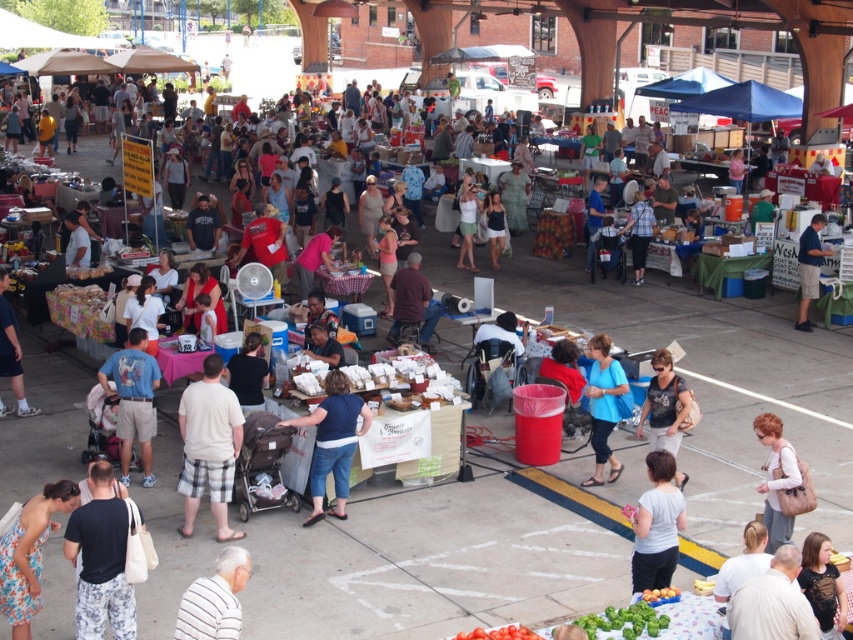
Question: Observing the image, what is the correct spatial positioning of light blue shirt at lower left in reference to green matte brussels sprouts at lower center?

Choices:
 (A) below
 (B) above

Answer: (B)

Question: Which object appears closest to the camera in this image?

Choices:
 (A) matte beige backpack at lower right
 (B) blue plaid shirt at center

Answer: (A)

Question: Which point is closer to the camera?

Choices:
 (A) light blue shirt at lower left
 (B) blue plaid shirt at center
 (C) white striped shirt at lower left
 (D) light brown hair at lower right

Answer: (C)

Question: Observing the image, what is the correct spatial positioning of beige fabric shorts at lower left in reference to blue plaid shirt at center?

Choices:
 (A) above
 (B) below

Answer: (B)

Question: Which point is closer to the camera taking this photo?

Choices:
 (A) (643, 554)
 (B) (358, 435)
 (C) (809, 230)

Answer: (A)

Question: Is matte beige backpack at lower right smaller than matte black shirt at center?

Choices:
 (A) no
 (B) yes

Answer: (A)